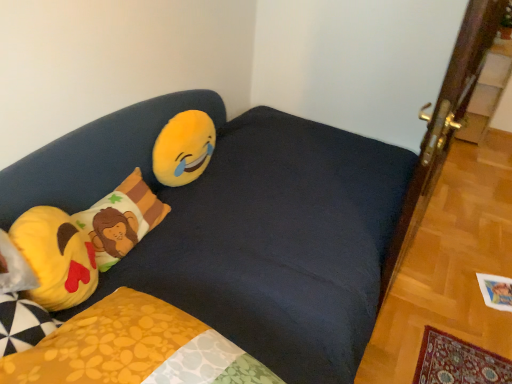
Question: Is yellow plush emoji at left, which is the 1th pillow in front-to-back order, to the left or to the right of yellow plush emoji at upper left in the image?

Choices:
 (A) left
 (B) right

Answer: (A)

Question: Is yellow plush emoji at left, the 2th pillow viewed from the back, taller or shorter than yellow plush emoji at upper left?

Choices:
 (A) tall
 (B) short

Answer: (B)

Question: Considering the real-world distances, which object is closest to the yellow plush emoji at upper left?

Choices:
 (A) dark blue fabric studio couch at upper left
 (B) yellow plush emoji at left, the 2th pillow viewed from the back
 (C) fluffy cotton pillow with lion design at left, placed as the 1th pillow when sorted from back to front

Answer: (C)

Question: Which of these objects is positioned closest to the yellow plush emoji at upper left?

Choices:
 (A) yellow plush emoji at left, which is the 1th pillow in front-to-back order
 (B) fluffy cotton pillow with lion design at left, placed as the 1th pillow when sorted from back to front
 (C) dark blue fabric studio couch at upper left

Answer: (B)